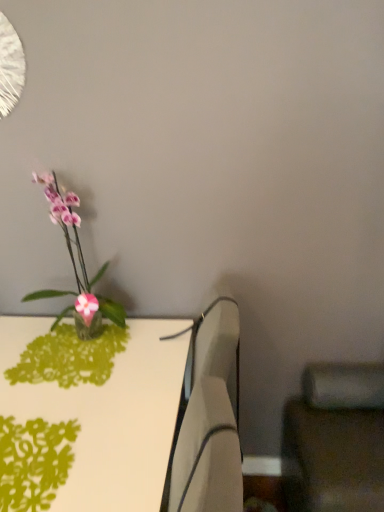
Question: Is the depth of pink glass vase at left greater than that of white plastic swivel chair at center, the first swivel chair from the left?

Choices:
 (A) no
 (B) yes

Answer: (A)

Question: From the image's perspective, is pink glass vase at left below white plastic swivel chair at center, the first swivel chair from the left?

Choices:
 (A) yes
 (B) no

Answer: (B)

Question: Is pink glass vase at left positioned with its back to white plastic swivel chair at center, which is the second swivel chair in right-to-left order?

Choices:
 (A) yes
 (B) no

Answer: (B)

Question: Can you confirm if pink glass vase at left is wider than white plastic swivel chair at center, which is the second swivel chair in right-to-left order?

Choices:
 (A) no
 (B) yes

Answer: (B)

Question: Does pink glass vase at left appear on the right side of white plastic swivel chair at center, which is the second swivel chair in right-to-left order?

Choices:
 (A) no
 (B) yes

Answer: (A)

Question: From the image's perspective, is pink glass vase at left over white plastic swivel chair at center, the first swivel chair from the left?

Choices:
 (A) yes
 (B) no

Answer: (A)

Question: From a real-world perspective, is white plastic swivel chair at center, the first swivel chair from the left, beneath green papercut at lower left?

Choices:
 (A) no
 (B) yes

Answer: (B)

Question: Is white plastic swivel chair at center, the first swivel chair from the left, at the left side of green papercut at lower left?

Choices:
 (A) no
 (B) yes

Answer: (A)

Question: Can you confirm if white plastic swivel chair at center, the first swivel chair from the left, is thinner than green papercut at lower left?

Choices:
 (A) no
 (B) yes

Answer: (B)

Question: Is white plastic swivel chair at center, which is the second swivel chair in right-to-left order, shorter than green papercut at lower left?

Choices:
 (A) no
 (B) yes

Answer: (A)

Question: Is white plastic swivel chair at center, the first swivel chair from the left, next to green papercut at lower left and touching it?

Choices:
 (A) yes
 (B) no

Answer: (B)

Question: Are white plastic swivel chair at center, the first swivel chair from the left, and green papercut at lower left far apart?

Choices:
 (A) no
 (B) yes

Answer: (A)

Question: From the image's perspective, is matte black swivel chair at lower right, which is counted as the second swivel chair, starting from the left, under green papercut at lower left?

Choices:
 (A) yes
 (B) no

Answer: (A)